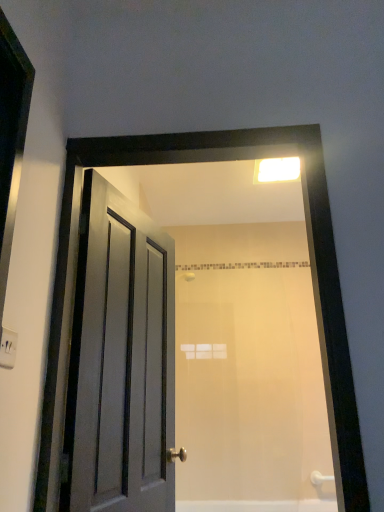
Question: Is white plastic light fixture at upper center far from matte wooden door at center?

Choices:
 (A) yes
 (B) no

Answer: (B)

Question: Considering the relative sizes of white plastic light fixture at upper center and matte wooden door at center in the image provided, is white plastic light fixture at upper center wider than matte wooden door at center?

Choices:
 (A) no
 (B) yes

Answer: (B)

Question: Is white plastic light fixture at upper center outside matte wooden door at center?

Choices:
 (A) yes
 (B) no

Answer: (A)

Question: Is white plastic light fixture at upper center touching matte wooden door at center?

Choices:
 (A) no
 (B) yes

Answer: (A)

Question: Is white plastic light fixture at upper center in front of matte wooden door at center?

Choices:
 (A) yes
 (B) no

Answer: (B)

Question: Is matte gray door at left taller or shorter than white matte bathtub at lower center?

Choices:
 (A) short
 (B) tall

Answer: (B)

Question: From the image's perspective, is matte gray door at left above or below white matte bathtub at lower center?

Choices:
 (A) above
 (B) below

Answer: (A)

Question: Considering the positions of point (145, 220) and point (215, 503), is point (145, 220) closer or farther from the camera than point (215, 503)?

Choices:
 (A) farther
 (B) closer

Answer: (B)

Question: From a real-world perspective, is matte gray door at left positioned above or below white matte bathtub at lower center?

Choices:
 (A) below
 (B) above

Answer: (B)

Question: From a real-world perspective, relative to white matte bathtub at lower center, is white plastic electric outlet at upper left vertically above or below?

Choices:
 (A) above
 (B) below

Answer: (A)

Question: Would you say white plastic electric outlet at upper left is inside or outside white matte bathtub at lower center?

Choices:
 (A) inside
 (B) outside

Answer: (B)

Question: Is white plastic electric outlet at upper left in front of or behind white matte bathtub at lower center in the image?

Choices:
 (A) front
 (B) behind

Answer: (A)

Question: Is point (0, 349) positioned closer to the camera than point (180, 501)?

Choices:
 (A) farther
 (B) closer

Answer: (B)

Question: From a real-world perspective, is white matte bathtub at lower center physically located above or below matte wooden door at center?

Choices:
 (A) below
 (B) above

Answer: (A)

Question: From the image's perspective, relative to matte wooden door at center, is white matte bathtub at lower center above or below?

Choices:
 (A) below
 (B) above

Answer: (A)